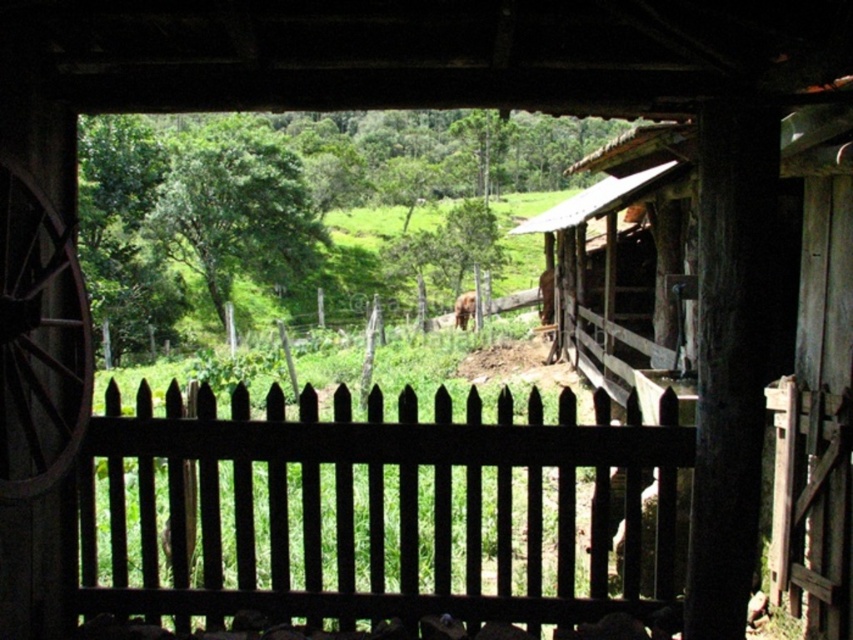
Between brown furry horse at center and brown fur at center, which one has less height?

Standing shorter between the two is brown furry horse at center.

Between brown furry horse at center and brown fur at center, which one is positioned higher?

brown furry horse at center is higher up.

Locate an element on the screen. The width and height of the screenshot is (853, 640). brown furry horse at center is located at coordinates (546, 296).

Can you confirm if black wooden fence at center is positioned to the right of brown fur at center?

No, black wooden fence at center is not to the right of brown fur at center.

Is point (605, 541) farther from camera compared to point (469, 308)?

No, (605, 541) is closer to viewer.

Where is `black wooden fence at center`? black wooden fence at center is located at coordinates (364, 509).

Identify the location of black wooden fence at center. [x=364, y=509].

Where is `black wooden fence at center`? The image size is (853, 640). black wooden fence at center is located at coordinates (364, 509).

Can you confirm if black wooden fence at center is positioned to the left of rustic wood wagon wheel at left?

In fact, black wooden fence at center is to the right of rustic wood wagon wheel at left.

Measure the distance between point (453, 614) and camera.

The distance of point (453, 614) from camera is 4.05 meters.

You are a GUI agent. You are given a task and a screenshot of the screen. Output one action in this format:
    pyautogui.click(x=<x>, y=<y>)
    Task: Click on the black wooden fence at center
    The image size is (853, 640).
    Given the screenshot: What is the action you would take?
    pyautogui.click(x=364, y=509)